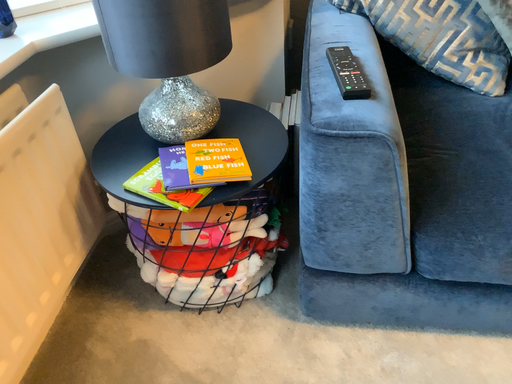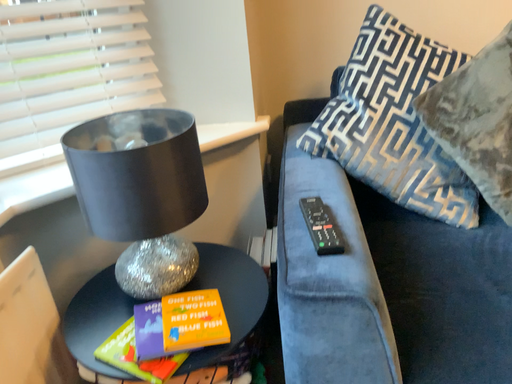
Question: How did the camera likely rotate when shooting the video?

Choices:
 (A) rotated upward
 (B) rotated downward

Answer: (A)